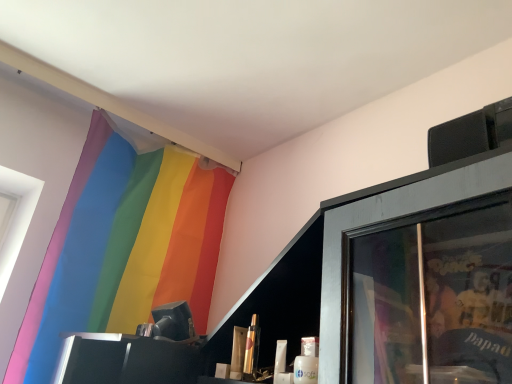
Question: Is rainbow fabric curtain at upper left bigger than metallic gold lipstick at center, the 2th toiletry in the left-to-right sequence?

Choices:
 (A) yes
 (B) no

Answer: (A)

Question: Is rainbow fabric curtain at upper left to the left of metallic gold lipstick at center, marked as the 1th toiletry in a right-to-left arrangement, from the viewer's perspective?

Choices:
 (A) yes
 (B) no

Answer: (A)

Question: Is rainbow fabric curtain at upper left turned away from metallic gold lipstick at center, marked as the 1th toiletry in a right-to-left arrangement?

Choices:
 (A) yes
 (B) no

Answer: (B)

Question: Is rainbow fabric curtain at upper left taller than metallic gold lipstick at center, marked as the 1th toiletry in a right-to-left arrangement?

Choices:
 (A) yes
 (B) no

Answer: (A)

Question: Is rainbow fabric curtain at upper left to the right of metallic gold lipstick at center, the 2th toiletry in the left-to-right sequence, from the viewer's perspective?

Choices:
 (A) yes
 (B) no

Answer: (B)

Question: Considering the relative positions of metallic gold lipstick at center, positioned as the second toiletry in right-to-left order, and rainbow fabric curtain at upper left in the image provided, is metallic gold lipstick at center, positioned as the second toiletry in right-to-left order, to the left or to the right of rainbow fabric curtain at upper left?

Choices:
 (A) left
 (B) right

Answer: (B)

Question: Considering the positions of metallic gold lipstick at center, positioned as the second toiletry in right-to-left order, and rainbow fabric curtain at upper left in the image, is metallic gold lipstick at center, positioned as the second toiletry in right-to-left order, bigger or smaller than rainbow fabric curtain at upper left?

Choices:
 (A) big
 (B) small

Answer: (B)

Question: Considering the positions of metallic gold lipstick at center, positioned as the second toiletry in right-to-left order, and rainbow fabric curtain at upper left in the image, is metallic gold lipstick at center, positioned as the second toiletry in right-to-left order, wider or thinner than rainbow fabric curtain at upper left?

Choices:
 (A) wide
 (B) thin

Answer: (B)

Question: Relative to rainbow fabric curtain at upper left, is metallic gold lipstick at center, positioned as the second toiletry in right-to-left order, in front or behind?

Choices:
 (A) behind
 (B) front

Answer: (B)

Question: Is metallic gold lipstick at center, the 1th toiletry in the left-to-right sequence, taller or shorter than metallic gold lipstick at center, marked as the 1th toiletry in a right-to-left arrangement?

Choices:
 (A) tall
 (B) short

Answer: (B)

Question: In the image, is metallic gold lipstick at center, positioned as the second toiletry in right-to-left order, on the left side or the right side of metallic gold lipstick at center, marked as the 1th toiletry in a right-to-left arrangement?

Choices:
 (A) right
 (B) left

Answer: (B)

Question: Is metallic gold lipstick at center, the 1th toiletry in the left-to-right sequence, inside the boundaries of metallic gold lipstick at center, marked as the 1th toiletry in a right-to-left arrangement, or outside?

Choices:
 (A) outside
 (B) inside

Answer: (A)

Question: Considering their positions, is metallic gold lipstick at center, the 1th toiletry in the left-to-right sequence, located in front of or behind metallic gold lipstick at center, marked as the 1th toiletry in a right-to-left arrangement?

Choices:
 (A) behind
 (B) front

Answer: (A)

Question: Is rainbow fabric curtain at upper left inside or outside of metallic gold lipstick at center, the 2th toiletry in the left-to-right sequence?

Choices:
 (A) outside
 (B) inside

Answer: (A)

Question: In the image, is rainbow fabric curtain at upper left on the left side or the right side of metallic gold lipstick at center, the 2th toiletry in the left-to-right sequence?

Choices:
 (A) left
 (B) right

Answer: (A)